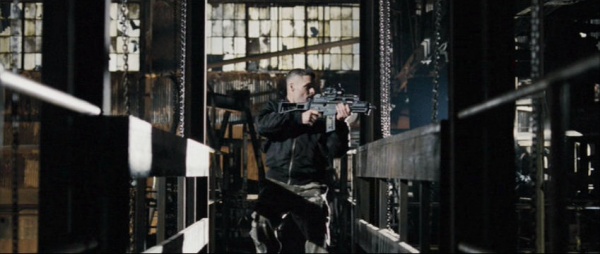
Where is `windows`? Image resolution: width=600 pixels, height=254 pixels. windows is located at coordinates 286,32.